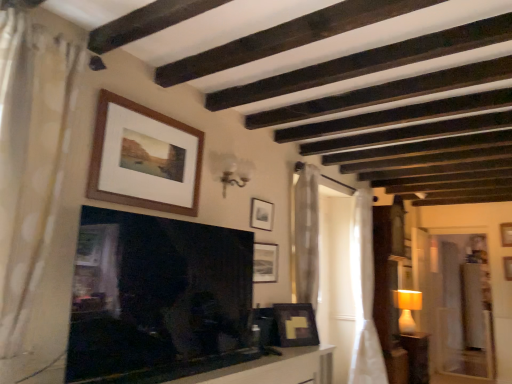
Question: Can you confirm if white dotted fabric curtain at left, the 3th curtain in the right-to-left sequence, is thinner than smooth white table at lower center?

Choices:
 (A) yes
 (B) no

Answer: (A)

Question: Is the depth of white dotted fabric curtain at left, which is counted as the 3th curtain, starting from the back, greater than that of smooth white table at lower center?

Choices:
 (A) yes
 (B) no

Answer: (B)

Question: Is white dotted fabric curtain at left, which is counted as the 3th curtain, starting from the back, at the left side of smooth white table at lower center?

Choices:
 (A) no
 (B) yes

Answer: (B)

Question: From the image's perspective, is white dotted fabric curtain at left, the 3th curtain in the right-to-left sequence, beneath smooth white table at lower center?

Choices:
 (A) yes
 (B) no

Answer: (B)

Question: Does white dotted fabric curtain at left, placed as the first curtain when sorted from front to back, have a smaller size compared to smooth white table at lower center?

Choices:
 (A) yes
 (B) no

Answer: (A)

Question: Is point (109, 127) positioned closer to the camera than point (262, 200)?

Choices:
 (A) closer
 (B) farther

Answer: (A)

Question: From the image's perspective, is wooden frame at upper center, acting as the first picture frame starting from the left, above or below matte black picture frame at upper center, acting as the fourth picture frame starting from the bottom?

Choices:
 (A) below
 (B) above

Answer: (B)

Question: From a real-world perspective, is wooden frame at upper center, positioned as the first picture frame in top-to-bottom order, physically located above or below matte black picture frame at upper center, acting as the fourth picture frame starting from the bottom?

Choices:
 (A) below
 (B) above

Answer: (B)

Question: Do you think wooden frame at upper center, positioned as the first picture frame in top-to-bottom order, is within matte black picture frame at upper center, which is counted as the 4th picture frame, starting from the front, or outside of it?

Choices:
 (A) inside
 (B) outside

Answer: (B)

Question: In the image, is wooden side table at right on the left side or the right side of wooden picture frame at upper center, placed as the 5th picture frame when sorted from front to back?

Choices:
 (A) right
 (B) left

Answer: (B)

Question: In terms of height, does wooden side table at right look taller or shorter compared to wooden picture frame at upper center, the 4th picture frame positioned from the top?

Choices:
 (A) tall
 (B) short

Answer: (A)

Question: Looking at the image, does wooden side table at right seem bigger or smaller compared to wooden picture frame at upper center, the 4th picture frame positioned from the top?

Choices:
 (A) big
 (B) small

Answer: (A)

Question: In terms of width, does wooden side table at right look wider or thinner when compared to wooden picture frame at upper center, the 5th picture frame viewed from the left?

Choices:
 (A) thin
 (B) wide

Answer: (B)

Question: From a real-world perspective, is wooden frame at upper center, acting as the first picture frame starting from the left, physically located above or below white sheer curtain at right, the 1th curtain viewed from the back?

Choices:
 (A) above
 (B) below

Answer: (A)

Question: In terms of width, does wooden frame at upper center, which appears as the 5th picture frame when ordered from the bottom, look wider or thinner when compared to white sheer curtain at right, which ranks as the 1th curtain in right-to-left order?

Choices:
 (A) thin
 (B) wide

Answer: (A)